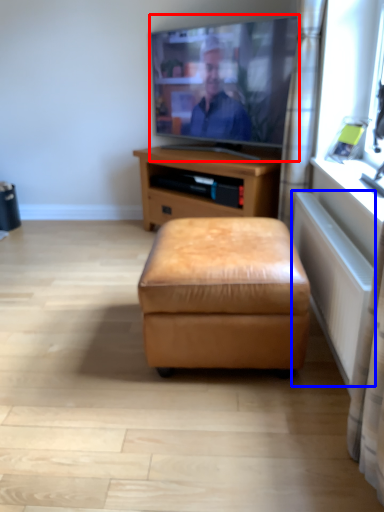
Question: Which point is further to the camera, television (highlighted by a red box) or radiator (highlighted by a blue box)?

Choices:
 (A) television
 (B) radiator

Answer: (A)